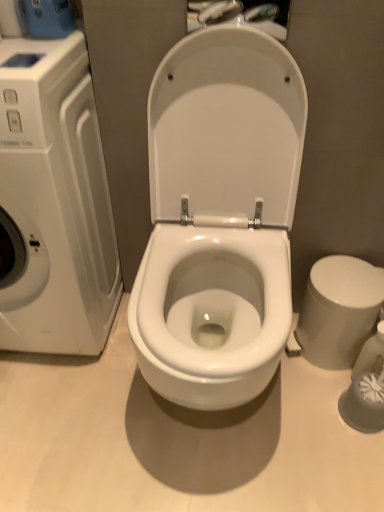
Question: In terms of height, does white glossy washing machine at left look taller or shorter compared to white glossy bidet at right?

Choices:
 (A) tall
 (B) short

Answer: (A)

Question: From a real-world perspective, is white glossy washing machine at left physically located above or below white glossy bidet at right?

Choices:
 (A) below
 (B) above

Answer: (B)

Question: Considering the positions of white glossy washing machine at left and white glossy bidet at right in the image, is white glossy washing machine at left wider or thinner than white glossy bidet at right?

Choices:
 (A) wide
 (B) thin

Answer: (A)

Question: Visually, is white glossy bidet at right positioned to the left or to the right of white glossy washing machine at left?

Choices:
 (A) left
 (B) right

Answer: (B)

Question: From a real-world perspective, is white glossy bidet at right above or below white glossy washing machine at left?

Choices:
 (A) above
 (B) below

Answer: (B)

Question: Does point (306, 300) appear closer or farther from the camera than point (51, 203)?

Choices:
 (A) farther
 (B) closer

Answer: (A)

Question: From the image's perspective, relative to white glossy washing machine at left, is white glossy bidet at right above or below?

Choices:
 (A) below
 (B) above

Answer: (A)